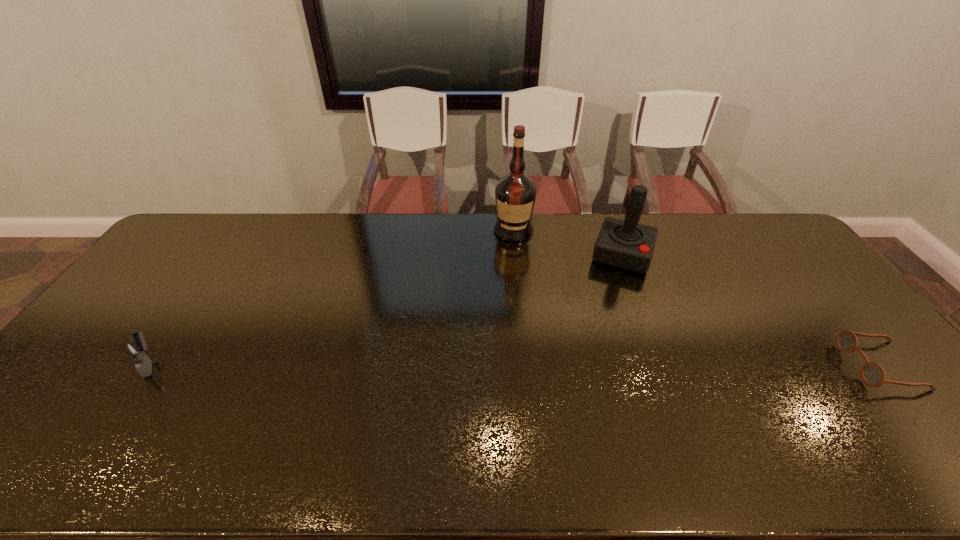
I want to click on object that is at the right edge, so click(x=872, y=374).

Where is `free location at the far edge`? Image resolution: width=960 pixels, height=540 pixels. free location at the far edge is located at coordinates (446, 223).

Where is `vacant space at the near edge of the desktop`? This screenshot has width=960, height=540. vacant space at the near edge of the desktop is located at coordinates (112, 429).

In the image, there is a desktop. Where is `vacant area at the left edge`? vacant area at the left edge is located at coordinates (55, 384).

The width and height of the screenshot is (960, 540). In order to click on blank area at the right edge in this screenshot , I will do `click(854, 323)`.

Locate an element on the screen. The height and width of the screenshot is (540, 960). free space at the near left corner of the desktop is located at coordinates (22, 417).

Identify the location of vacant space at the far right corner. The height and width of the screenshot is (540, 960). (736, 224).

This screenshot has height=540, width=960. Identify the location of free space between the spectacles and the third object from left to right. (752, 310).

Identify the location of empty location between the second tallest object and the rightmost object. (752, 310).

This screenshot has height=540, width=960. I want to click on free space between the leftmost object and the spectacles, so click(516, 364).